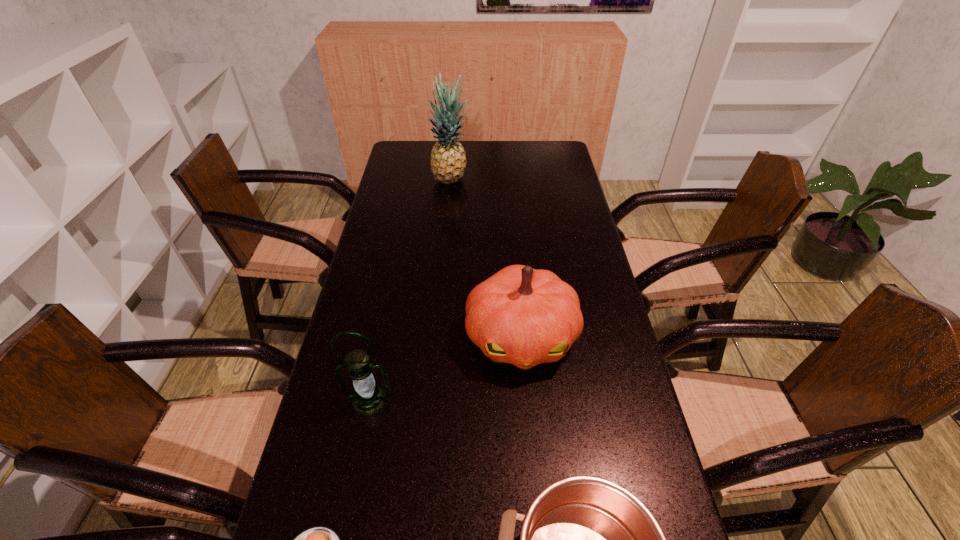
The width and height of the screenshot is (960, 540). I want to click on free space at the left edge of the desktop, so click(369, 244).

At what (x,y) coordinates should I click in order to perform the action: click on free space at the right edge. Please return your answer as a coordinate pair (x, y). The height and width of the screenshot is (540, 960). Looking at the image, I should click on (559, 262).

The image size is (960, 540). I want to click on vacant area at the far right corner of the desktop, so click(539, 164).

I want to click on empty location between the pumpkin and the tallest object, so click(486, 259).

What are the coordinates of `free point between the pineapple and the fourth nearest object` in the screenshot? It's located at [x=486, y=259].

Image resolution: width=960 pixels, height=540 pixels. Find the location of `free area in between the third nearest object and the pumpkin`. free area in between the third nearest object and the pumpkin is located at coordinates (445, 368).

At what (x,y) coordinates should I click in order to perform the action: click on free space between the pumpkin and the farthest object. Please return your answer as a coordinate pair (x, y). Image resolution: width=960 pixels, height=540 pixels. Looking at the image, I should click on click(x=486, y=259).

Image resolution: width=960 pixels, height=540 pixels. I want to click on vacant area that lies between the pumpkin and the farthest object, so [486, 259].

Point out which object is positioned as the nearest to the second shortest object. Please provide its 2D coordinates. Your answer should be formatted as a tuple, i.e. [(x, y)], where the tuple contains the x and y coordinates of a point satisfying the conditions above.

[(521, 316)]

The height and width of the screenshot is (540, 960). What are the coordinates of `object that is the third closest one to the pumpkin` in the screenshot? It's located at (320, 539).